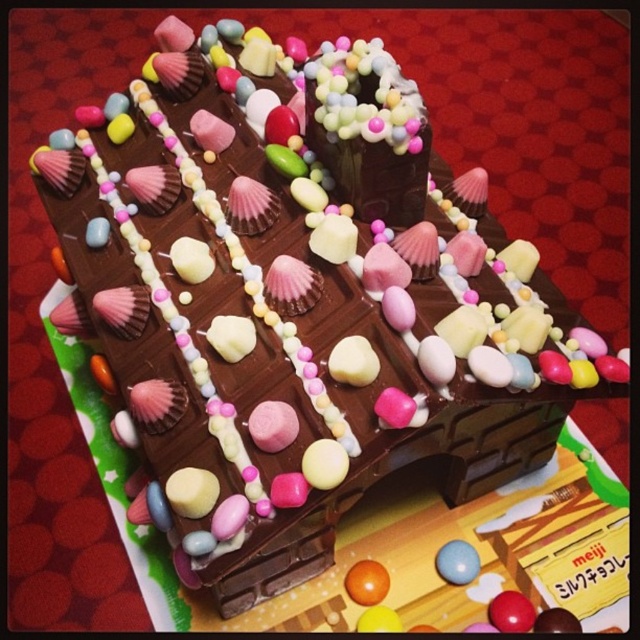
Based on the photo, between orange glossy candy at center and matte blue sphere at center, which one is positioned higher?

Positioned higher is matte blue sphere at center.

Who is shorter, orange glossy candy at center or matte blue sphere at center?

orange glossy candy at center

Between point (376, 561) and point (452, 577), which one is positioned in front?

Point (452, 577)

The width and height of the screenshot is (640, 640). I want to click on orange glossy candy at center, so click(365, 582).